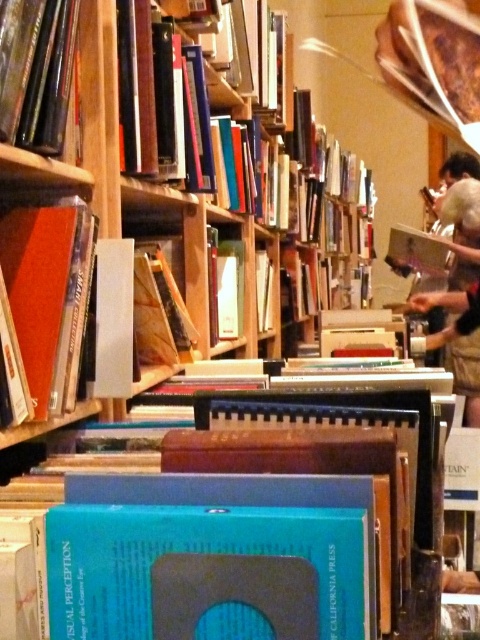
Question: Which of the following is the farthest from the observer?

Choices:
 (A) (60, 49)
 (B) (22, 241)
 (C) (242, 317)

Answer: (C)

Question: Observing the image, what is the correct spatial positioning of matte orange book at left in reference to hardcover book at upper left?

Choices:
 (A) above
 (B) below

Answer: (B)

Question: In this image, where is matte orange book at left located relative to hardcover book at center?

Choices:
 (A) below
 (B) above

Answer: (A)

Question: Which object is the closest to the hardcover book at center?

Choices:
 (A) matte orange book at left
 (B) blue hardcover book at center
 (C) light brown fabric shirt at upper right
 (D) hardcover book at upper left

Answer: (A)

Question: Among these points, which one is nearest to the camera?

Choices:
 (A) (46, 237)
 (B) (279, 625)

Answer: (B)

Question: Is blue hardcover book at center thinner than light brown fabric shirt at upper right?

Choices:
 (A) no
 (B) yes

Answer: (B)